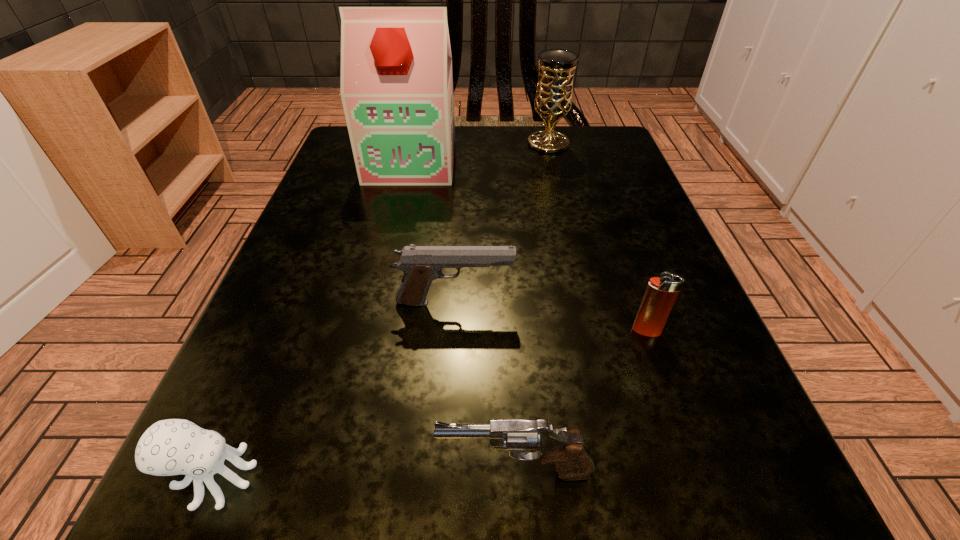
The width and height of the screenshot is (960, 540). Find the location of `octopus that is at the left edge`. octopus that is at the left edge is located at coordinates (169, 447).

Locate an element on the screen. chalice that is at the right edge is located at coordinates (553, 100).

The width and height of the screenshot is (960, 540). In order to click on igniter at the right edge in this screenshot , I will do `click(661, 292)`.

The width and height of the screenshot is (960, 540). Identify the location of object that is at the far left corner. (396, 88).

Image resolution: width=960 pixels, height=540 pixels. What are the coordinates of `object at the near left corner` in the screenshot? It's located at coord(169,447).

Where is `object located in the far right corner section of the desktop`? Image resolution: width=960 pixels, height=540 pixels. object located in the far right corner section of the desktop is located at coordinates (553, 100).

The width and height of the screenshot is (960, 540). In the image, there is a desktop. What are the coordinates of `blank space at the far edge` in the screenshot? It's located at (496, 174).

Where is `vacant space at the near edge of the desktop`? vacant space at the near edge of the desktop is located at coordinates pos(458,497).

This screenshot has width=960, height=540. In order to click on vacant space at the left edge in this screenshot , I will do `click(294, 290)`.

The height and width of the screenshot is (540, 960). In the image, there is a desktop. Find the location of `vacant area at the right edge`. vacant area at the right edge is located at coordinates (656, 351).